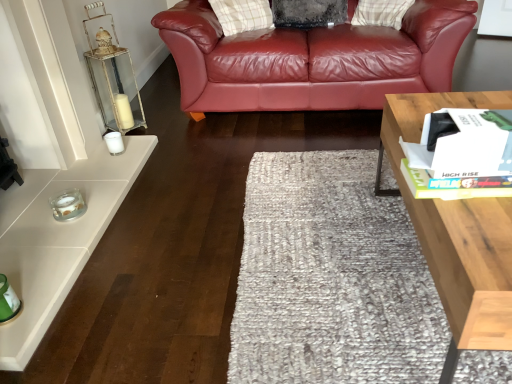
The image size is (512, 384). Find the location of `unoccupied region to the right of white glass candle at left, the first candle holder from the back`. unoccupied region to the right of white glass candle at left, the first candle holder from the back is located at coordinates (157, 163).